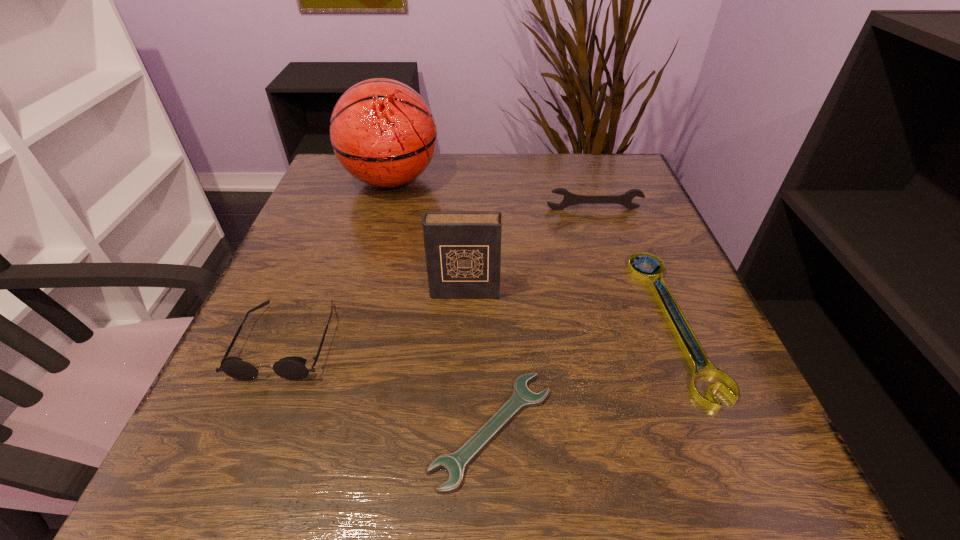
I want to click on vacant space at the far edge of the desktop, so click(x=550, y=158).

In the image, there is a desktop. At what (x,y) coordinates should I click in order to perform the action: click on vacant space at the near edge. Please return your answer as a coordinate pair (x, y). The width and height of the screenshot is (960, 540). Looking at the image, I should click on tap(396, 503).

In the image, there is a desktop. Where is `free region at the left edge`? The width and height of the screenshot is (960, 540). free region at the left edge is located at coordinates (273, 395).

Find the location of a particular element. free region at the right edge is located at coordinates (632, 239).

The height and width of the screenshot is (540, 960). Identify the location of vacant region at the far left corner of the desktop. (355, 198).

The height and width of the screenshot is (540, 960). I want to click on free point at the far right corner, so click(x=584, y=173).

I want to click on free space between the shortest wrench and the farthest object, so click(442, 305).

Where is `free space between the basketball and the sunglasses`? free space between the basketball and the sunglasses is located at coordinates (340, 260).

You are a GUI agent. You are given a task and a screenshot of the screen. Output one action in this format:
    pyautogui.click(x=<x>, y=<y>)
    Task: Click on the unoccupied position between the sunglasses and the fifth shortest object
    
    Given the screenshot: What is the action you would take?
    pyautogui.click(x=375, y=316)

Where is `empty space that is in between the diary and the sunglasses`? The image size is (960, 540). empty space that is in between the diary and the sunglasses is located at coordinates (375, 316).